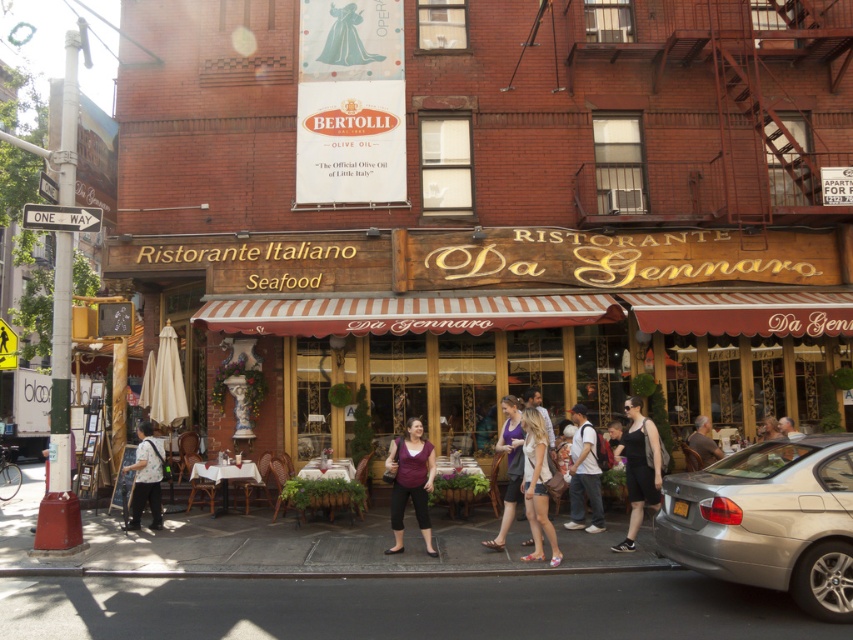
Question: Can you confirm if silver metallic sedan at lower right is positioned to the right of matte brown hair at center?

Choices:
 (A) yes
 (B) no

Answer: (B)

Question: Which object is closer to the camera taking this photo?

Choices:
 (A) purple fabric dress at center
 (B) floral-patterned shirt at center
 (C) matte black shirt at center
 (D) brown wooden sign at center

Answer: (A)

Question: Which point is closer to the camera?

Choices:
 (A) white cotton shirt at center
 (B) brown wooden sign at center
 (C) matte black shirt at center

Answer: (A)

Question: Is floral-patterned shirt at center positioned at the back of purple fabric dress at center?

Choices:
 (A) yes
 (B) no

Answer: (A)

Question: Which of these objects is positioned farthest from the black fabric dress at lower right?

Choices:
 (A) floral-patterned shirt at center
 (B) silver metallic sedan at lower right
 (C) purple matte shirt at center

Answer: (A)

Question: Does purple matte shirt at center appear over purple fabric dress at center?

Choices:
 (A) yes
 (B) no

Answer: (A)